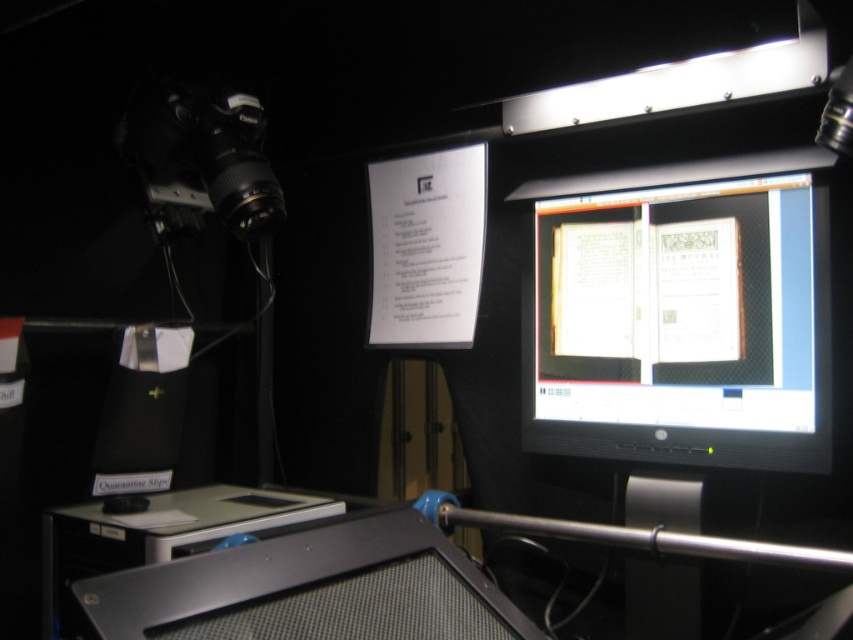
Looking at this image, can you confirm if black plastic video camera at upper left is positioned to the left of silver metallic table at lower left?

Correct, you'll find black plastic video camera at upper left to the left of silver metallic table at lower left.

The image size is (853, 640). What do you see at coordinates (200, 161) in the screenshot? I see `black plastic video camera at upper left` at bounding box center [200, 161].

Between point (143, 122) and point (334, 500), which one is positioned in front?

Positioned in front is point (143, 122).

Where is `black plastic video camera at upper left`? black plastic video camera at upper left is located at coordinates (200, 161).

Where is `matte black monitor at center`? The image size is (853, 640). matte black monitor at center is located at coordinates (682, 314).

Does point (567, 352) come closer to viewer compared to point (219, 589)?

That is False.

Is point (662, 192) positioned after point (148, 612)?

Yes, point (662, 192) is behind point (148, 612).

Where is `matte black monitor at center`? The width and height of the screenshot is (853, 640). matte black monitor at center is located at coordinates (682, 314).

Between point (663, 320) and point (239, 234), which one is positioned behind?

Point (239, 234)

Based on the photo, measure the distance between matte black monitor at center and black plastic video camera at upper left.

matte black monitor at center and black plastic video camera at upper left are 33.96 inches apart from each other.

Which is behind, point (581, 412) or point (241, 122)?

Positioned behind is point (241, 122).

Image resolution: width=853 pixels, height=640 pixels. In order to click on matte black monitor at center in this screenshot , I will do `click(682, 314)`.